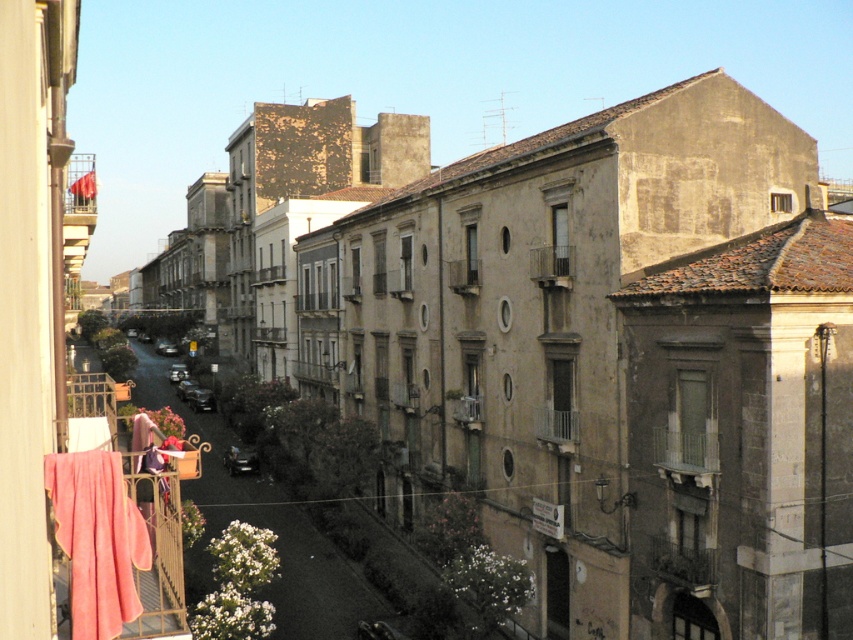
Question: Is pink velvety towel at lower left positioned in front of metallic gray balcony at center?

Choices:
 (A) no
 (B) yes

Answer: (B)

Question: Is pink velvety towel at lower left thinner than metallic gray balcony at center?

Choices:
 (A) no
 (B) yes

Answer: (B)

Question: Which point appears farthest from the camera in this image?

Choices:
 (A) (143, 534)
 (B) (561, 272)

Answer: (B)

Question: Does pink velvety towel at lower left appear on the right side of metallic gray balcony at center?

Choices:
 (A) no
 (B) yes

Answer: (A)

Question: Which of the following is the farthest from the observer?

Choices:
 (A) pink velvety towel at lower left
 (B) metallic gray balcony at center

Answer: (B)